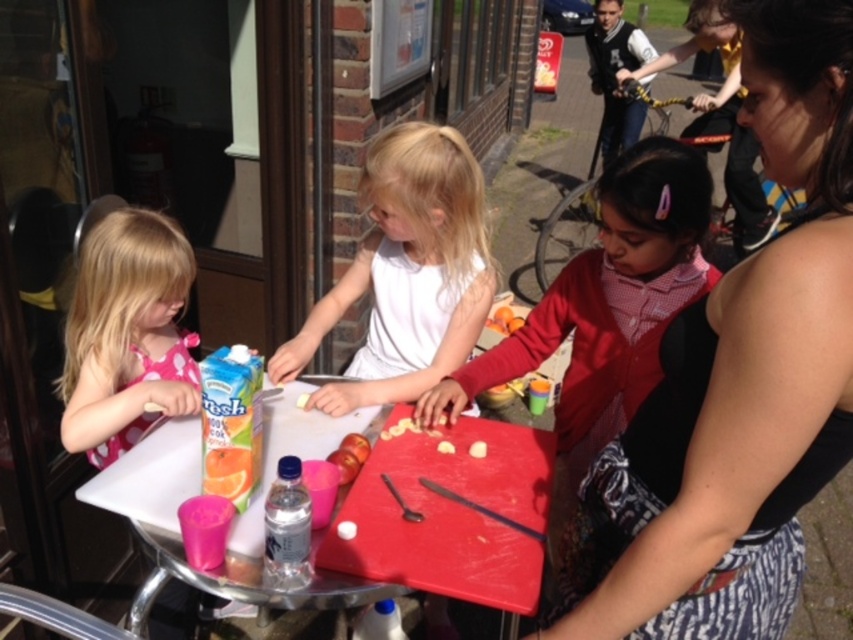
Question: Is white matte shirt at center positioned at the back of matte plastic table at center?

Choices:
 (A) yes
 (B) no

Answer: (A)

Question: Is the position of white matte shirt at center less distant than that of pink fabric dress at left?

Choices:
 (A) yes
 (B) no

Answer: (B)

Question: Which point is farther from the camera taking this photo?

Choices:
 (A) (839, 269)
 (B) (541, 362)
 (C) (271, 444)

Answer: (B)

Question: Can you confirm if matte red jacket at center is wider than matte plastic table at center?

Choices:
 (A) yes
 (B) no

Answer: (B)

Question: Which point is closer to the camera?

Choices:
 (A) pink fabric dress at left
 (B) matte red jacket at center
 (C) matte black tank top at center

Answer: (C)

Question: Which of the following is the closest to the observer?

Choices:
 (A) (343, 419)
 (B) (83, 310)

Answer: (A)